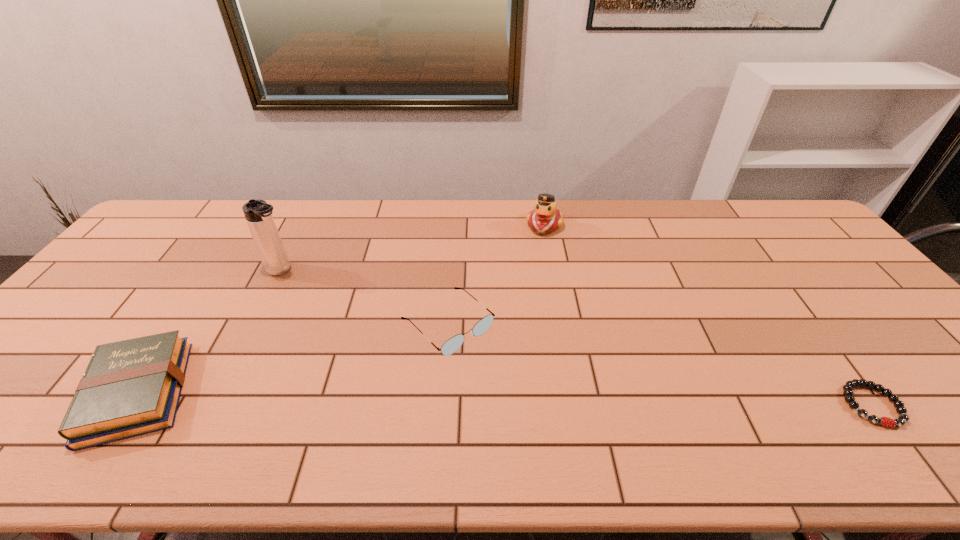
Identify the location of the leftmost object. This screenshot has width=960, height=540. (132, 387).

Locate an element on the screen. the shortest object is located at coordinates 848,388.

Identify the location of bracelet. This screenshot has height=540, width=960. (848, 388).

Locate an element on the screen. the second tallest object is located at coordinates (545, 217).

At what (x,y) coordinates should I click in order to perform the action: click on the farthest object. Please return your answer as a coordinate pair (x, y). This screenshot has height=540, width=960. Looking at the image, I should click on (545, 217).

In order to click on thermos bottle in this screenshot , I will do `click(258, 214)`.

Identify the location of the second object from left to right. The image size is (960, 540). tap(258, 214).

At what (x,y) coordinates should I click in order to perform the action: click on the third object from left to right. Please return your answer as a coordinate pair (x, y). Looking at the image, I should click on [x=453, y=344].

Locate an element on the screen. vacant space located 0.050m on the left of the leftmost object is located at coordinates (61, 393).

Locate an element on the screen. vacant space located on the back of the shortest object is located at coordinates (802, 311).